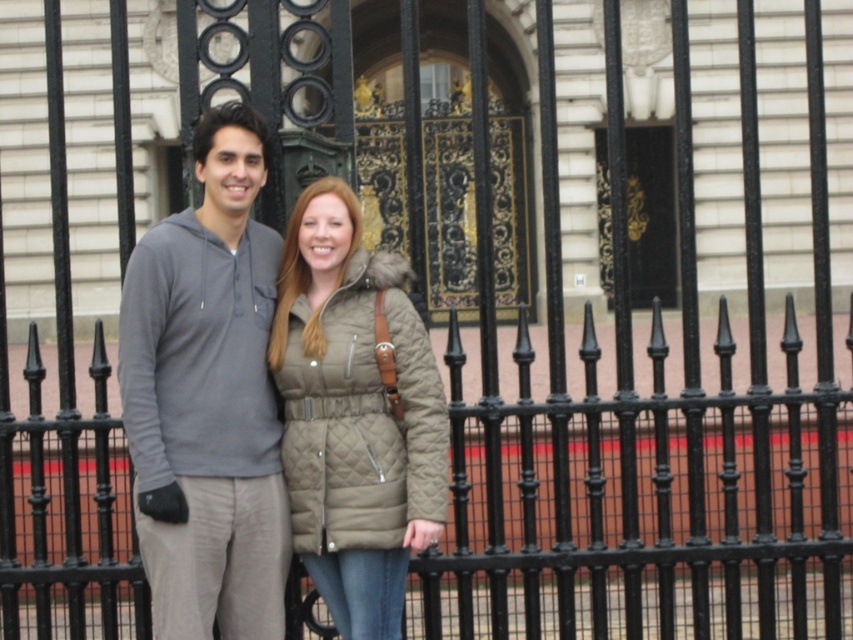
Question: Does quilted olive coat at center have a larger size compared to gold ornate door at center?

Choices:
 (A) yes
 (B) no

Answer: (B)

Question: Which of the following is the closest to the observer?

Choices:
 (A) quilted olive coat at center
 (B) gray hoodie at center
 (C) gold ornate door at center

Answer: (B)

Question: Which of the following is the closest to the observer?

Choices:
 (A) (248, 364)
 (B) (599, 193)

Answer: (A)

Question: Does gray hoodie at center come in front of gold ornate door at center?

Choices:
 (A) yes
 (B) no

Answer: (A)

Question: Can you confirm if gray hoodie at center is positioned to the left of quilted olive coat at center?

Choices:
 (A) no
 (B) yes

Answer: (B)

Question: Among these objects, which one is farthest from the camera?

Choices:
 (A) gray hoodie at center
 (B) quilted olive coat at center
 (C) gold ornate door at center

Answer: (C)